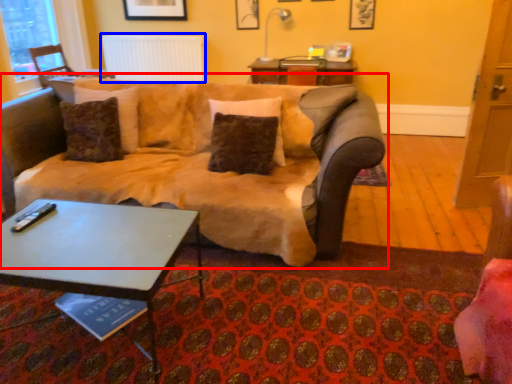
Question: Which point is further to the camera, studio couch (highlighted by a red box) or radiator (highlighted by a blue box)?

Choices:
 (A) studio couch
 (B) radiator

Answer: (B)